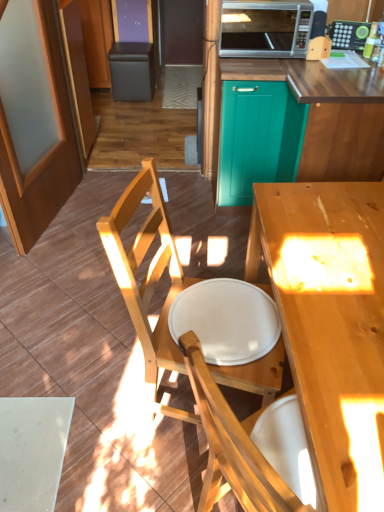
Where is `vacant space that is to the left of light wood chair at center`? vacant space that is to the left of light wood chair at center is located at coordinates (92, 398).